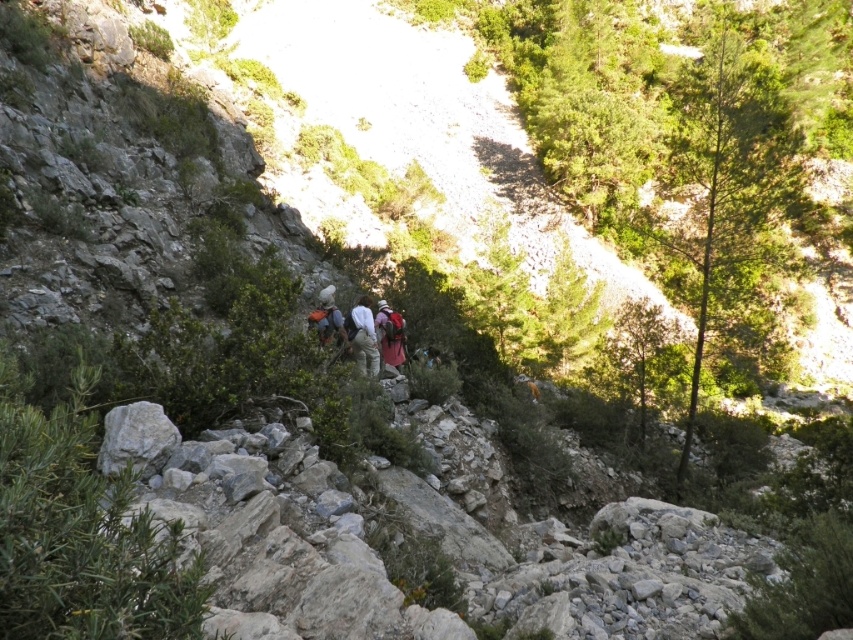
You are a hiker who wants to choose the backpack with more vertical space for carrying taller items. You see a white fabric backpack at center and a matte orange backpack at center. Which one should you choose?

The white fabric backpack at center has a greater height compared to the matte orange backpack at center, so you should choose the white fabric backpack at center for carrying taller items.

Looking at this image, you are a hiker planning to carry both the camouflage fabric backpack at center and the matte orange backpack at center on a steep trail. Which backpack will require more vertical space in your pack due to its height?

The camouflage fabric backpack at center requires more vertical space because it has a greater height compared to the matte orange backpack at center.